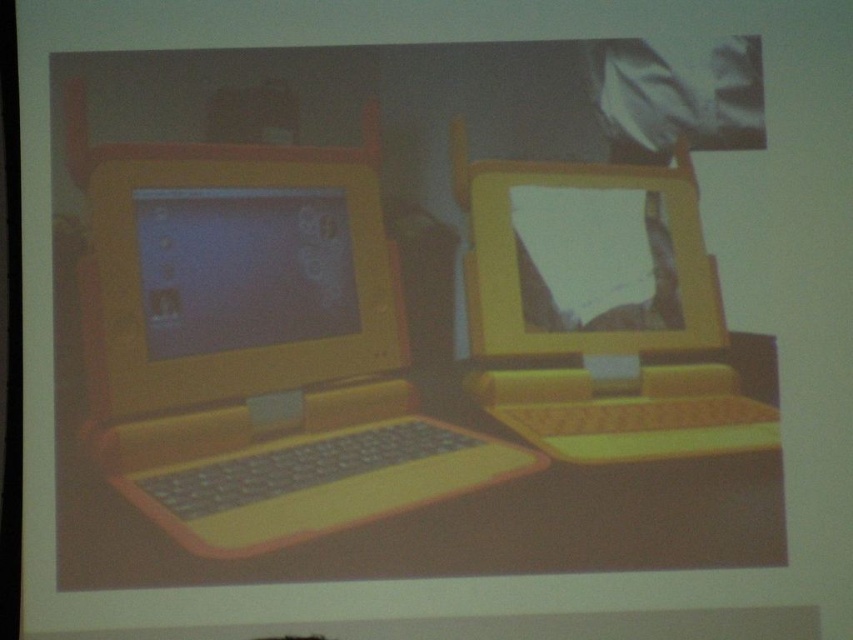
From the picture: Does yellow plastic laptop at center have a greater width compared to yellow plastic monitor at center?

Yes.

Which of these two, yellow plastic laptop at center or yellow plastic monitor at center, stands taller?

Standing taller between the two is yellow plastic laptop at center.

Between point (593, 404) and point (698, 317), which one is positioned behind?

Point (698, 317)

Where is `yellow plastic laptop at center`? Image resolution: width=853 pixels, height=640 pixels. yellow plastic laptop at center is located at coordinates (527, 262).

Does yellow plastic table at center have a lesser height compared to yellow plastic laptop at center?

Correct, yellow plastic table at center is not as tall as yellow plastic laptop at center.

Is point (726, 522) more distant than point (483, 376)?

No, it is in front of (483, 376).

You are a GUI agent. You are given a task and a screenshot of the screen. Output one action in this format:
    pyautogui.click(x=<x>, y=<y>)
    Task: Click on the yellow plastic table at center
    Image resolution: width=853 pixels, height=640 pixels.
    Given the screenshot: What is the action you would take?
    pyautogui.click(x=442, y=522)

I want to click on yellow matte laptop at left, so click(259, 348).

Between yellow matte laptop at left and yellow plastic table at center, which one has less height?

With less height is yellow plastic table at center.

I want to click on yellow matte laptop at left, so coord(259,348).

At what (x,y) coordinates should I click in order to perform the action: click on yellow matte laptop at left. Please return your answer as a coordinate pair (x, y). The image size is (853, 640). Looking at the image, I should click on (259, 348).